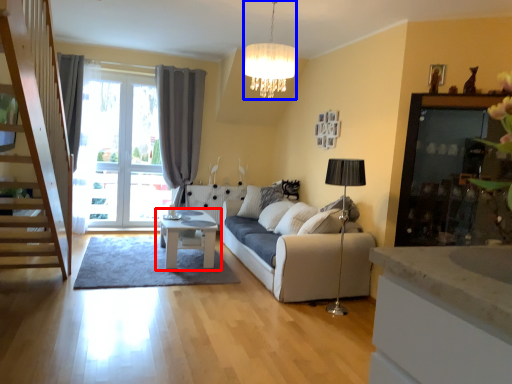
Question: Which object is closer to the camera taking this photo, table (highlighted by a red box) or lamp (highlighted by a blue box)?

Choices:
 (A) table
 (B) lamp

Answer: (B)